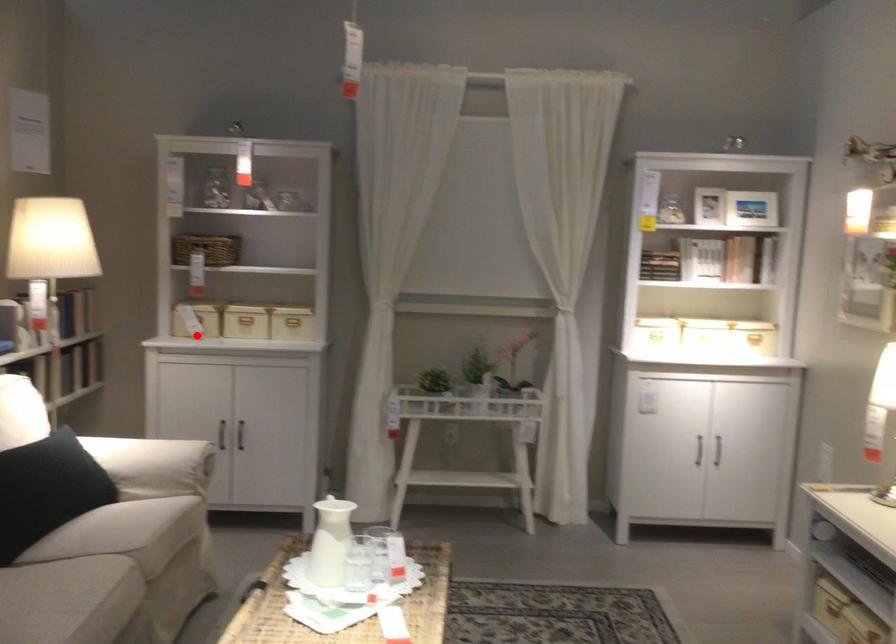
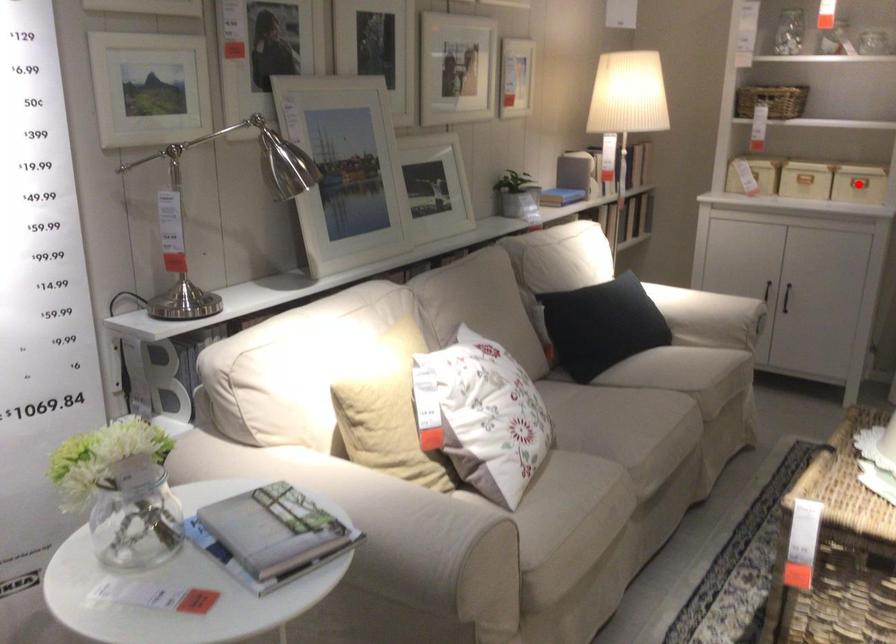
I am providing you with two images of the same scene from different viewpoints. A red point is marked on the first image and another point is marked on the second image. Do the highlighted points in image1 and image2 indicate the same real-world spot?

No